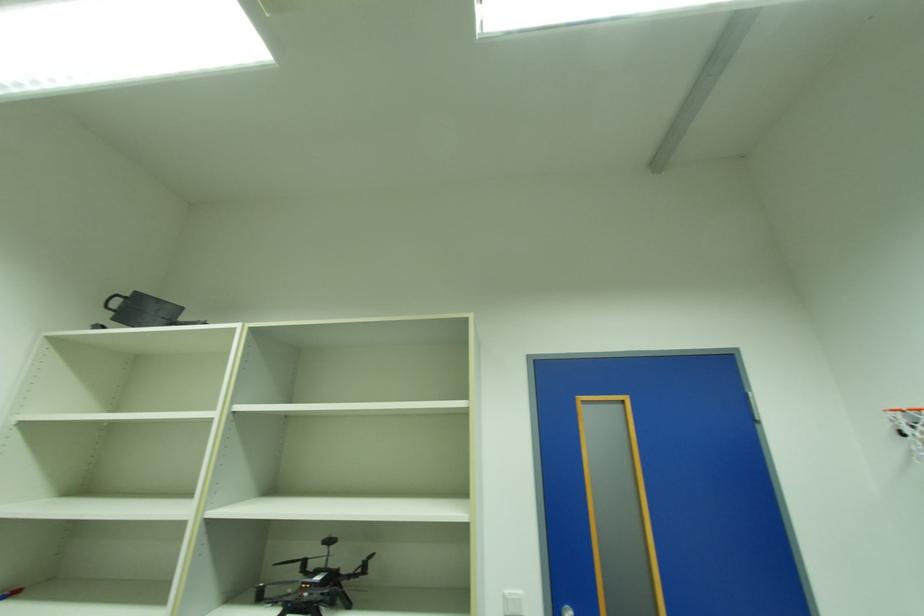
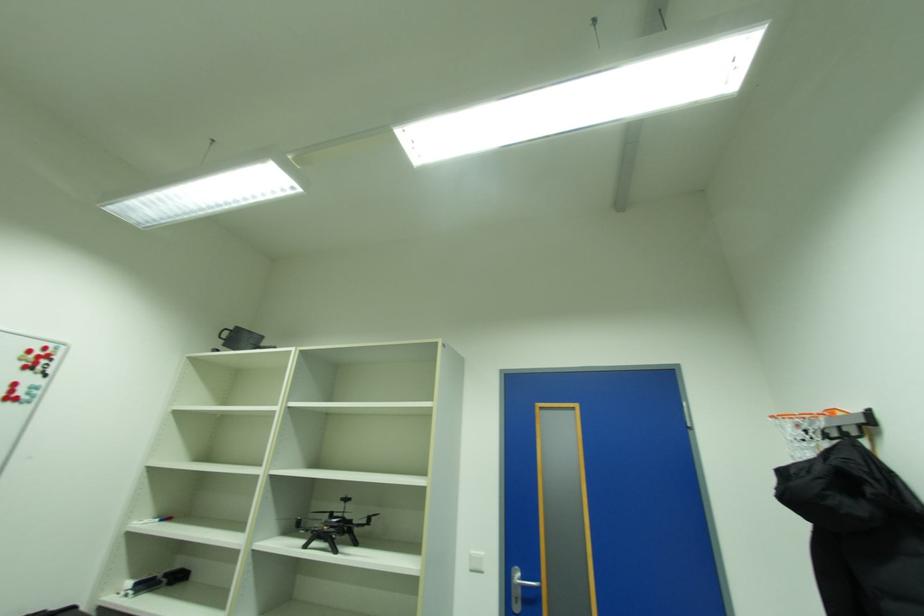
What movement of the cameraman would produce the second image?

The cameraman moved toward right, backward.